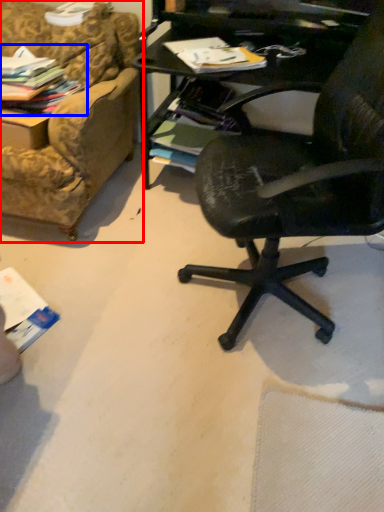
Question: Which of the following is the farthest to the observer, studio couch (highlighted by a red box) or magazine (highlighted by a blue box)?

Choices:
 (A) studio couch
 (B) magazine

Answer: (A)